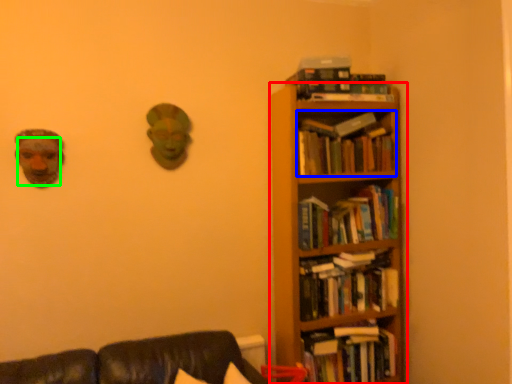
Question: Estimate the real-world distances between objects in this image. Which object is closer to bookcase (highlighted by a red box), book (highlighted by a blue box) or human face (highlighted by a green box)?

Choices:
 (A) book
 (B) human face

Answer: (A)